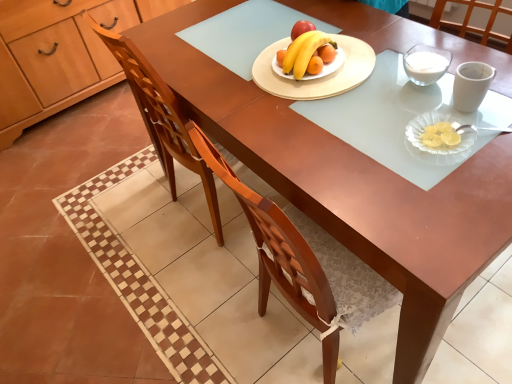
The width and height of the screenshot is (512, 384). I want to click on free space that is to the left of wooden round platter at center, which is counted as the first platter, starting from the left, so click(220, 74).